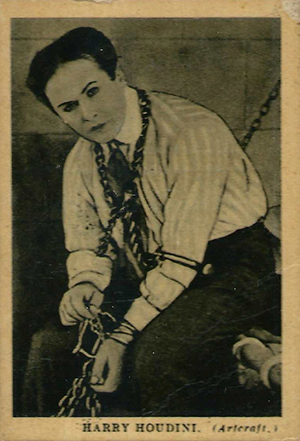
Identify the location of border of the old picture. (294, 58).